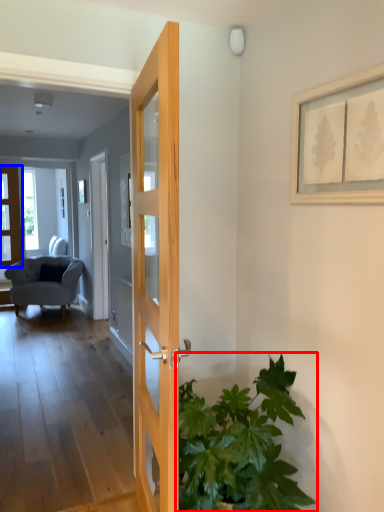
Question: Which of the following is the farthest to the observer, houseplant (highlighted by a red box) or door (highlighted by a blue box)?

Choices:
 (A) houseplant
 (B) door

Answer: (B)